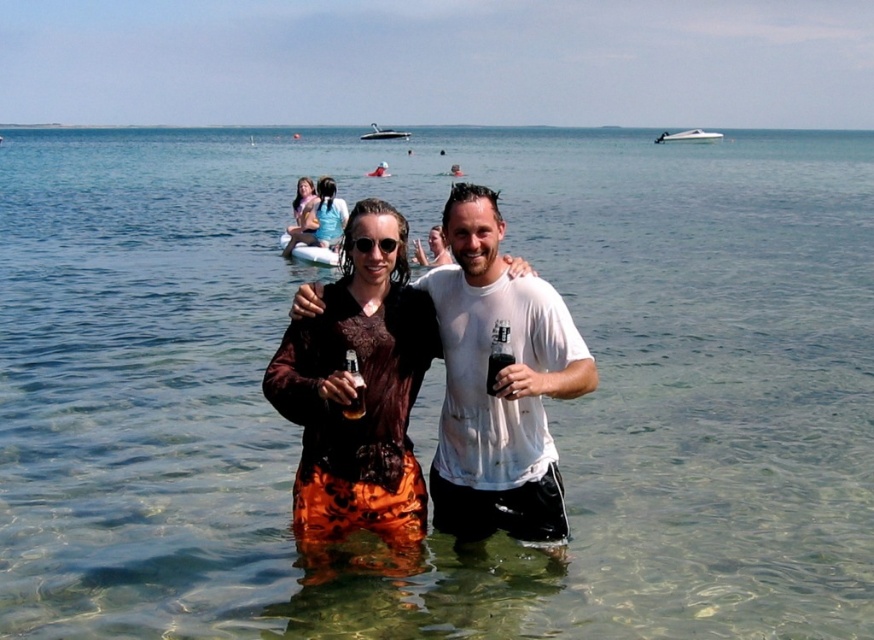
Is matte pink bikini top at upper center above black matte glass at center?

Correct, matte pink bikini top at upper center is located above black matte glass at center.

Is point (302, 186) farther from camera compared to point (487, 372)?

That is True.

Identify the location of matte pink bikini top at upper center. (302, 216).

You are a GUI agent. You are given a task and a screenshot of the screen. Output one action in this format:
    pyautogui.click(x=<x>, y=<y>)
    Task: Click on the matte pink bikini top at upper center
    The image size is (874, 640).
    Given the screenshot: What is the action you would take?
    pyautogui.click(x=302, y=216)

From the picture: Can you confirm if white cotton t-shirt at center is positioned below matte pink bikini top at upper center?

Indeed, white cotton t-shirt at center is positioned under matte pink bikini top at upper center.

Can you confirm if white cotton t-shirt at center is positioned above matte pink bikini top at upper center?

Incorrect, white cotton t-shirt at center is not positioned above matte pink bikini top at upper center.

Locate an element on the screen. Image resolution: width=874 pixels, height=640 pixels. white cotton t-shirt at center is located at coordinates (498, 387).

Where is `white cotton t-shirt at center`? Image resolution: width=874 pixels, height=640 pixels. white cotton t-shirt at center is located at coordinates (498, 387).

Does blue fabric bikini top at center appear under matte black sunglasses at center?

Actually, blue fabric bikini top at center is above matte black sunglasses at center.

Is blue fabric bikini top at center taller than matte black sunglasses at center?

Indeed, blue fabric bikini top at center has a greater height compared to matte black sunglasses at center.

What are the coordinates of `blue fabric bikini top at center` in the screenshot? It's located at (327, 216).

Identify the location of blue fabric bikini top at center. (327, 216).